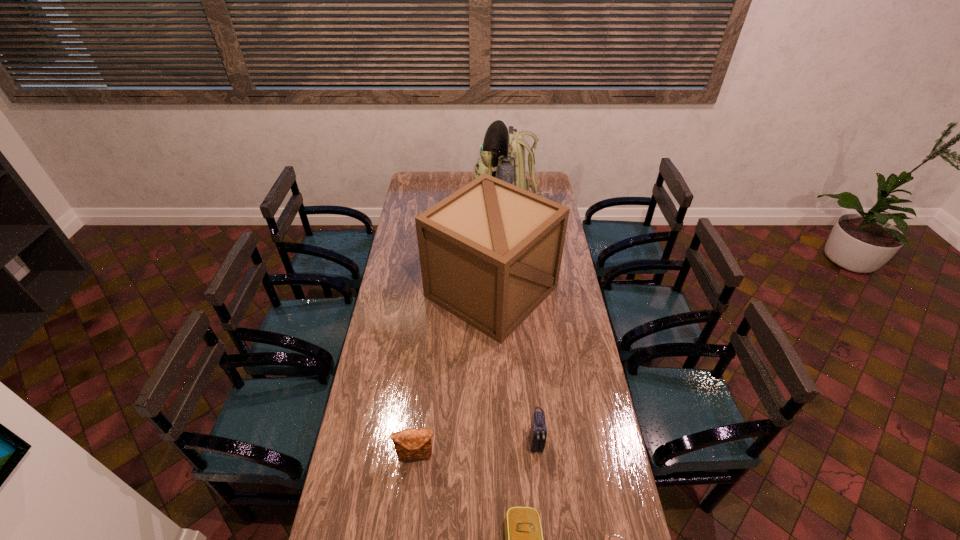
You are a GUI agent. You are given a task and a screenshot of the screen. Output one action in this format:
    pyautogui.click(x=<x>, y=<y>)
    Task: Click on the farthest object
    The height and width of the screenshot is (540, 960).
    Given the screenshot: What is the action you would take?
    pyautogui.click(x=502, y=153)

Locate an element on the screen. This screenshot has height=540, width=960. the tallest object is located at coordinates (502, 153).

Image resolution: width=960 pixels, height=540 pixels. Identify the location of box. (490, 253).

Where is `the fifth shortest object`? the fifth shortest object is located at coordinates (490, 253).

The height and width of the screenshot is (540, 960). What are the coordinates of `the leftmost clutch bag` in the screenshot? It's located at (410, 444).

Where is `free region located 0.370m on the front-facing side of the farthest object`? free region located 0.370m on the front-facing side of the farthest object is located at coordinates (406, 209).

In order to click on vacant space located on the front-facing side of the farthest object in this screenshot , I will do `click(422, 209)`.

Where is `free space located on the front-facing side of the farthest object`? This screenshot has width=960, height=540. free space located on the front-facing side of the farthest object is located at coordinates (454, 209).

Identify the location of vacant space located 0.050m on the right of the fifth nearest object. The image size is (960, 540). (569, 292).

Locate an element on the screen. This screenshot has height=540, width=960. vacant area situated on the open side of the leftmost clutch bag is located at coordinates (x=412, y=501).